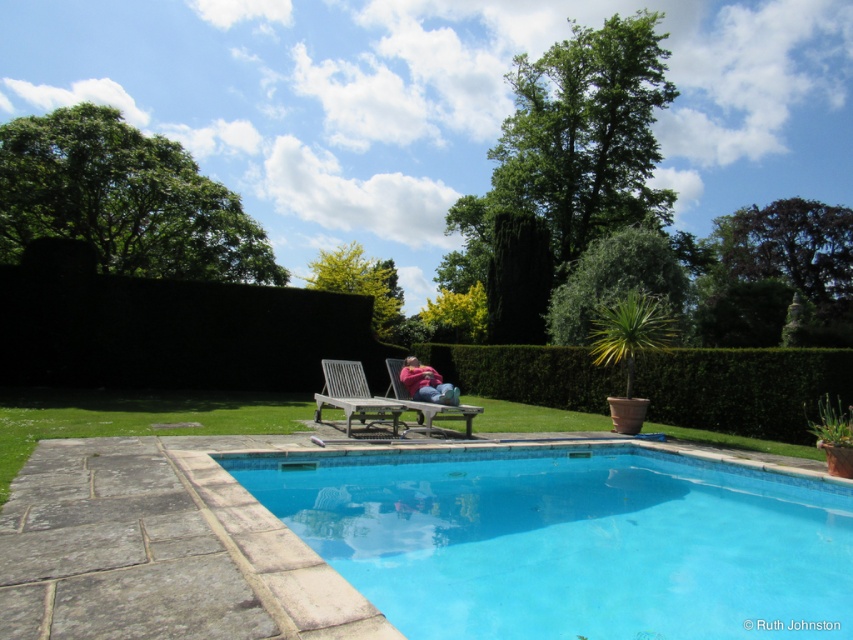
Question: Where is blue tile swimming pool at center located in relation to wooden slats lounge chair at center in the image?

Choices:
 (A) left
 (B) right

Answer: (B)

Question: Which of the following is the farthest from the observer?

Choices:
 (A) blue tile swimming pool at center
 (B) wooden slats lounge chair at center
 (C) pink fabric person at center
 (D) green leafy hedge at center

Answer: (D)

Question: Where is green leafy hedge at center located in relation to wooden slats lounge chair at center in the image?

Choices:
 (A) below
 (B) above

Answer: (B)

Question: Is blue tile swimming pool at center in front of pink fabric person at center?

Choices:
 (A) no
 (B) yes

Answer: (B)

Question: Which of the following is the farthest from the observer?

Choices:
 (A) (393, 384)
 (B) (701, 497)

Answer: (A)

Question: Which of the following is the closest to the observer?

Choices:
 (A) blue tile swimming pool at center
 (B) pink fabric person at center

Answer: (A)